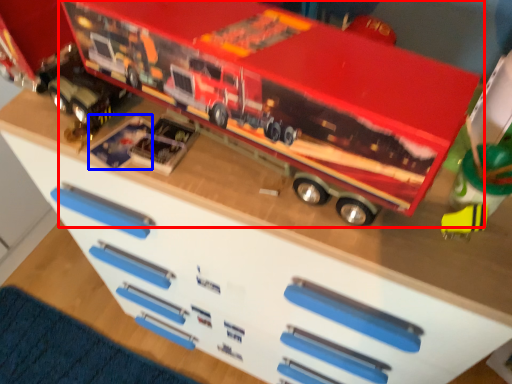
Question: Which point is further to the camera, toy (highlighted by a red box) or toy (highlighted by a blue box)?

Choices:
 (A) toy
 (B) toy

Answer: (B)